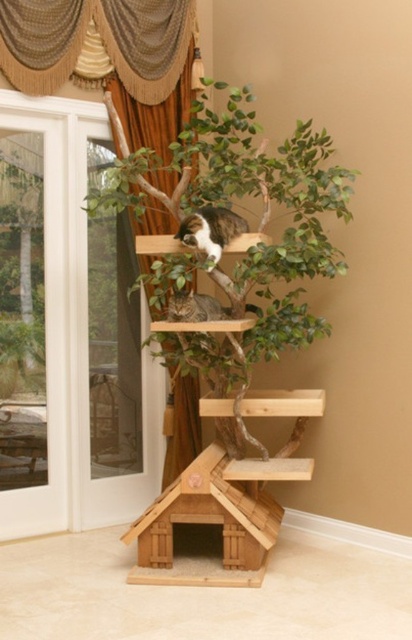
You are a cat owner who wants to ensure your cat has enough space to move around the wooden cat tree at center and the tabby fur cat at center. Based on the scene, which object is wider?

The wooden cat tree at center is wider than the tabby fur cat at center because the wooden cat tree at center has a greater width compared to the tabby fur cat at center.